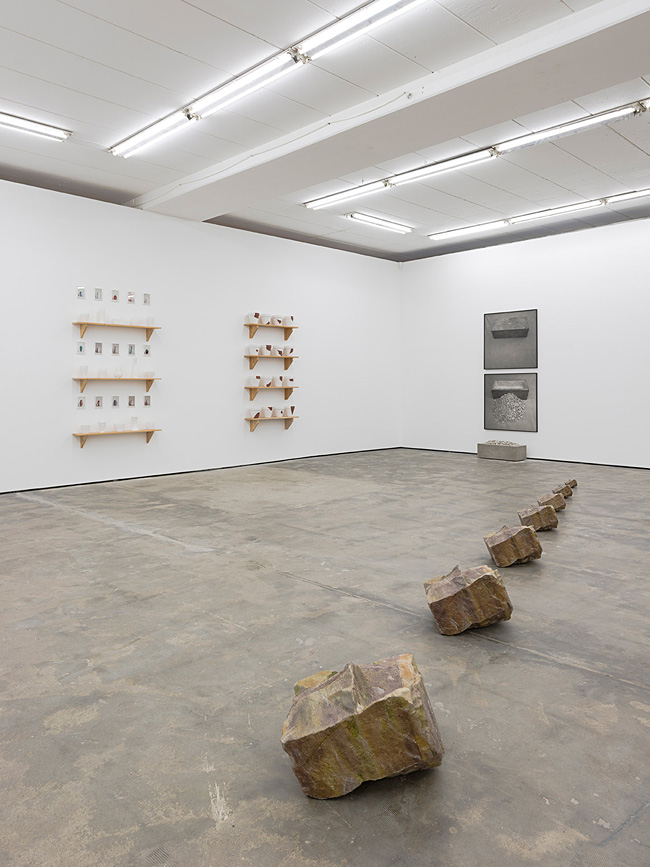
Locate an element on the screen. lights is located at coordinates (582, 210), (436, 168), (380, 225), (288, 57), (51, 135).